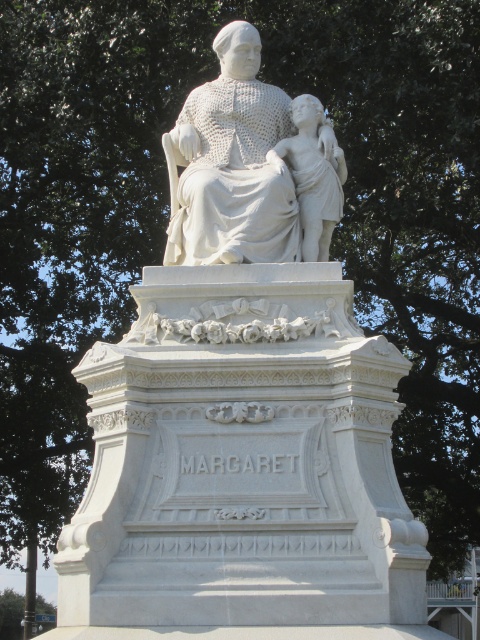
Question: Among these points, which one is nearest to the camera?

Choices:
 (A) 265,218
 (B) 23,612
 (C) 334,216

Answer: (A)

Question: Is white marble statue at center further to the viewer compared to white marble child at center?

Choices:
 (A) no
 (B) yes

Answer: (A)

Question: Is white marble statue at center positioned at the back of white marble child at center?

Choices:
 (A) yes
 (B) no

Answer: (B)

Question: Which point is closer to the camera taking this photo?

Choices:
 (A) (323, 237)
 (B) (325, 131)

Answer: (A)

Question: Which is farther from the white marble child at center?

Choices:
 (A) green leafy tree at lower left
 (B) white marble statue at center

Answer: (A)

Question: Does white marble statue at center have a larger size compared to green leafy tree at lower left?

Choices:
 (A) no
 (B) yes

Answer: (B)